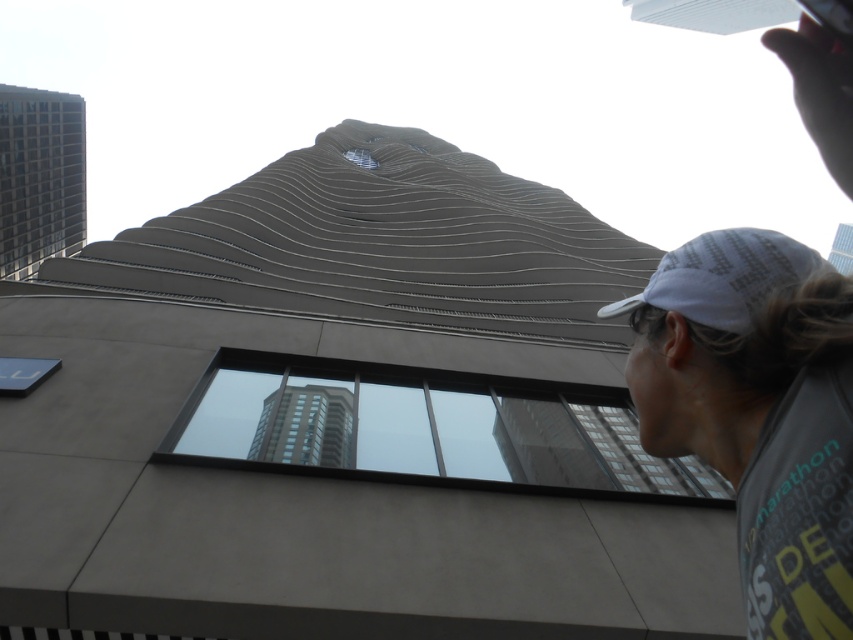
Question: Which object is the farthest from the white fabric baseball cap at upper right?

Choices:
 (A) white fabric cap at upper right
 (B) transparent glass window at center
 (C) metallic glass skyscraper at left

Answer: (C)

Question: Which object is farther from the camera taking this photo?

Choices:
 (A) metallic glass skyscraper at left
 (B) white fabric cap at upper right
 (C) white fabric baseball cap at upper right
 (D) transparent glass window at center

Answer: (A)

Question: Which point appears closest to the camera in this image?

Choices:
 (A) (657, 296)
 (B) (764, 289)
 (C) (80, 148)

Answer: (B)

Question: Is transparent glass window at center smaller than metallic glass skyscraper at left?

Choices:
 (A) no
 (B) yes

Answer: (B)

Question: Observing the image, what is the correct spatial positioning of white fabric cap at upper right in reference to white fabric baseball cap at upper right?

Choices:
 (A) left
 (B) right

Answer: (A)

Question: Can you confirm if white fabric cap at upper right is bigger than white fabric baseball cap at upper right?

Choices:
 (A) yes
 (B) no

Answer: (A)